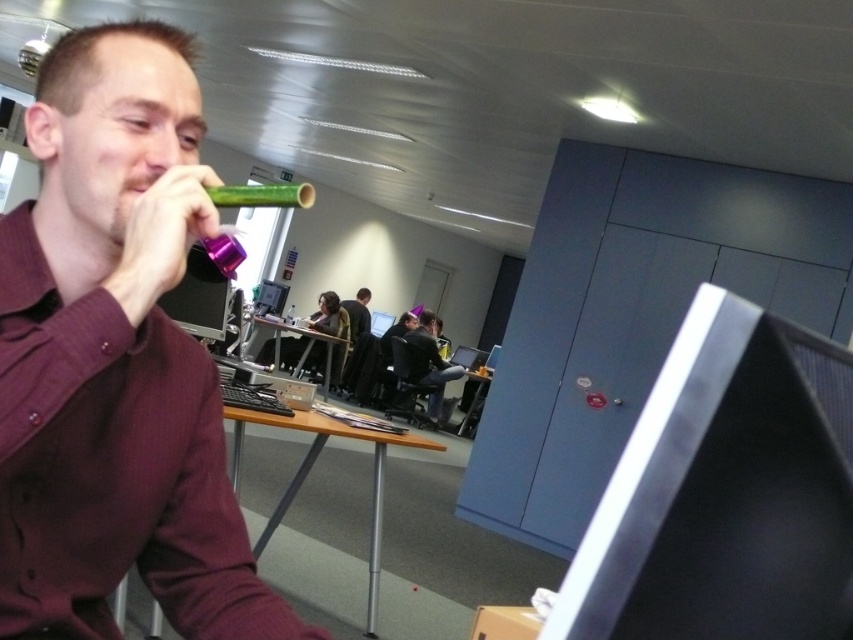
Question: Where is matte green horn at center located in relation to wooden table at center in the image?

Choices:
 (A) left
 (B) right

Answer: (B)

Question: Does wooden desk at center have a greater width compared to wooden table at center?

Choices:
 (A) yes
 (B) no

Answer: (B)

Question: Which object is closer to the camera taking this photo?

Choices:
 (A) matte black shirt at center
 (B) dark gray sweater at center
 (C) wooden desk at center
 (D) matte black monitor at right

Answer: (D)

Question: Which object is closer to the camera taking this photo?

Choices:
 (A) wooden table at center
 (B) matte black shirt at center

Answer: (A)

Question: Which is nearer to the wooden desk at center?

Choices:
 (A) matte black shirt at center
 (B) dark gray sweater at center
 (C) wooden table at center

Answer: (C)

Question: Can you confirm if matte green horn at center is positioned above wooden desk at center?

Choices:
 (A) yes
 (B) no

Answer: (A)